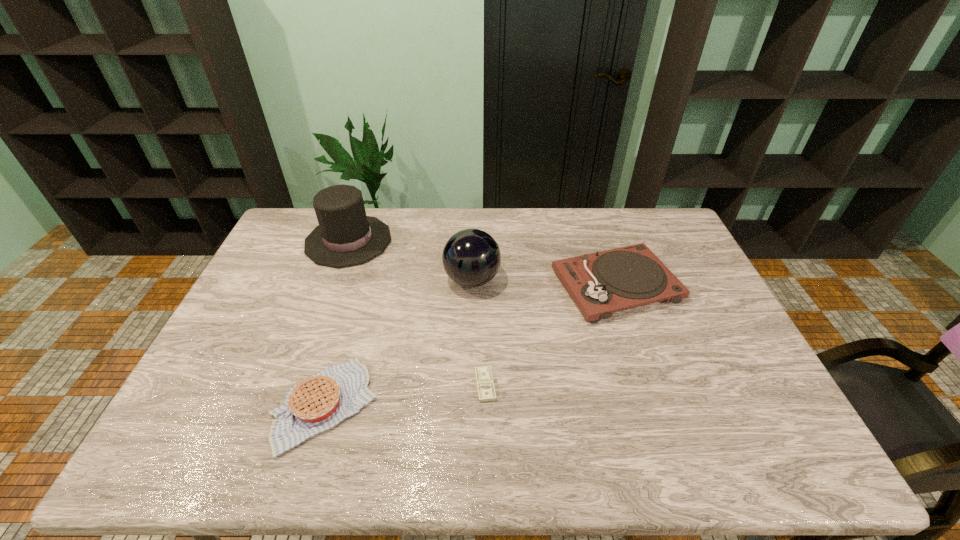
I want to click on free space between the shortest object and the bowling ball, so click(478, 333).

Where is `object identified as the second closest to the rightmost object`? The image size is (960, 540). object identified as the second closest to the rightmost object is located at coordinates (485, 385).

Find the location of a particular element. Image resolution: width=960 pixels, height=540 pixels. object that stands as the fourth closest to the shortest object is located at coordinates (346, 236).

Where is `vacant position in the image that satisfies the following two spatial constraints: 1. on the side of the bowling ball with the finger holes; 2. on the front side of the pie`? vacant position in the image that satisfies the following two spatial constraints: 1. on the side of the bowling ball with the finger holes; 2. on the front side of the pie is located at coordinates (469, 405).

You are a GUI agent. You are given a task and a screenshot of the screen. Output one action in this format:
    pyautogui.click(x=<x>, y=<y>)
    Task: Click on the vacant space that satisfies the following two spatial constraints: 1. on the front of the pie with the decoration; 2. on the right side of the dress hat
    Image resolution: width=960 pixels, height=540 pixels.
    Given the screenshot: What is the action you would take?
    pyautogui.click(x=289, y=405)

Where is `free point that satisfies the following two spatial constraints: 1. on the back side of the pie; 2. on the right side of the shortest object`? The height and width of the screenshot is (540, 960). free point that satisfies the following two spatial constraints: 1. on the back side of the pie; 2. on the right side of the shortest object is located at coordinates (330, 385).

I want to click on blank area in the image that satisfies the following two spatial constraints: 1. on the side of the shortest object with the finger holes; 2. on the left side of the bowling ball, so click(x=469, y=385).

You are a GUI agent. You are given a task and a screenshot of the screen. Output one action in this format:
    pyautogui.click(x=<x>, y=<y>)
    Task: Click on the free point that satisfies the following two spatial constraints: 1. on the side of the rightmost object with the finger holes; 2. on the left side of the bowling ball
    
    Given the screenshot: What is the action you would take?
    pyautogui.click(x=472, y=285)

Locate an element on the screen. This screenshot has width=960, height=540. free space that satisfies the following two spatial constraints: 1. on the back side of the rightmost object; 2. on the front of the dress hat with the decoration is located at coordinates (601, 241).

Image resolution: width=960 pixels, height=540 pixels. What are the coordinates of `vacant position in the image that satisfies the following two spatial constraints: 1. on the side of the bowling ball with the finger holes; 2. on the left side of the rightmost object` in the screenshot? It's located at (472, 285).